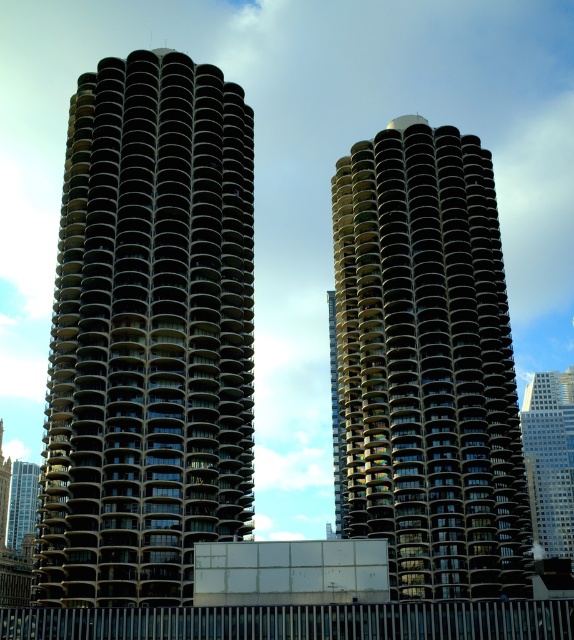
Based on the photo, you are standing at the point marked as point (149,333) in the image. Which direction should you walk to reach the dark gray concrete building at left?

The point (149,333) indicates the dark gray concrete building at left, so you are already at the dark gray concrete building at left.

You are an urban planner assessing the visual impact of these buildings. Given that the black glass building at center and the glassy reflective skyscraper at right are both prominent in the cityscape, which one takes up more area in the foreground of the image?

The glassy reflective skyscraper at right occupies more space in the foreground than the black glass building at center, as it is stated that the black glass building at center occupies less space than glassy reflective skyscraper at right.

You are standing in front of the two spiral high rise buildings. There are two points marked on the buildings. One is at coordinate point (108,493) and the other is at point (545,445). Which point is closer to you?

Point (108,493) is closer to the viewer than point (545,445).